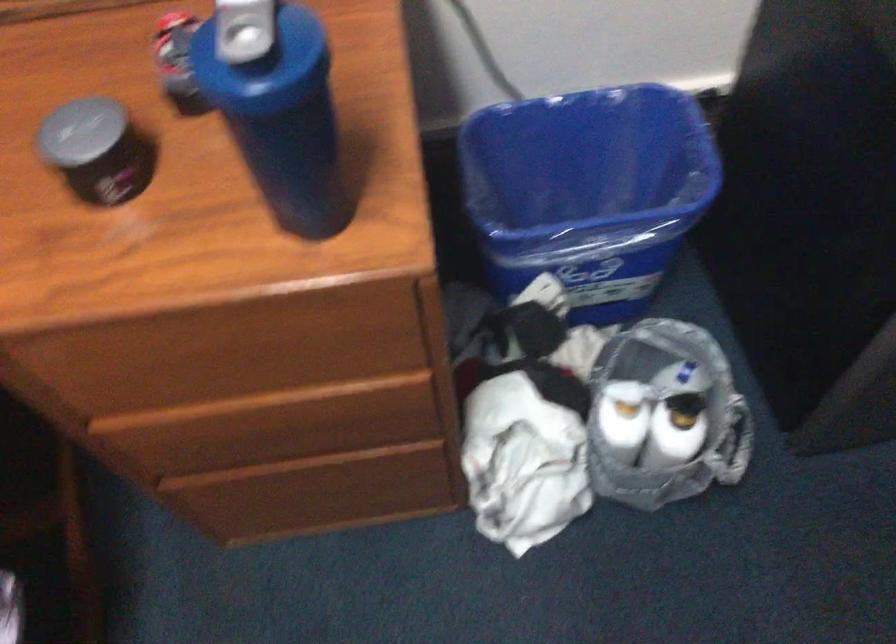
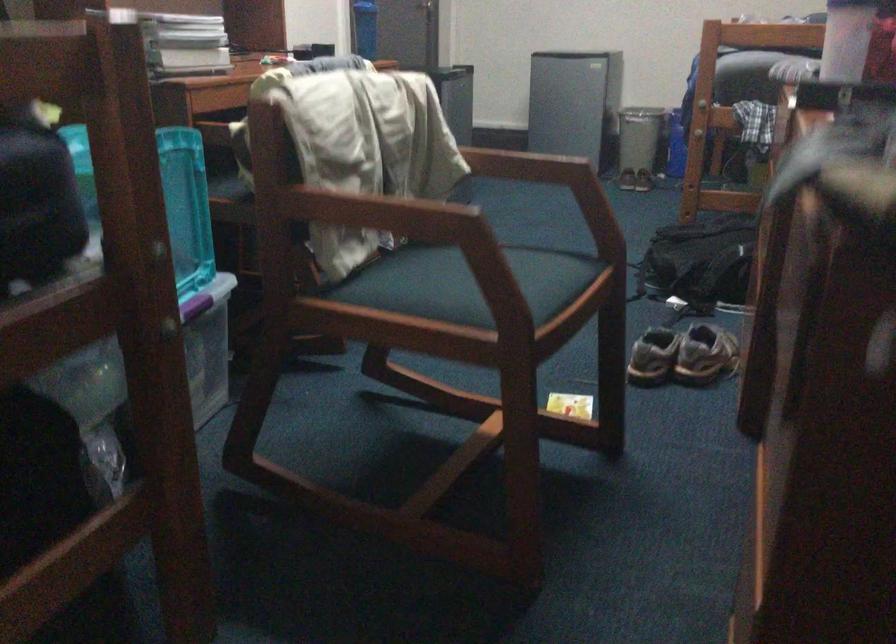
Question: I am providing you with two images of the same scene from different viewpoints. After the viewpoint changes to image2, which objects are now occluded?

Choices:
 (A) wooden chair armrest
 (B) silver mailbox door
 (C) pair of brown shoes
 (D) blue trash can

Answer: (D)